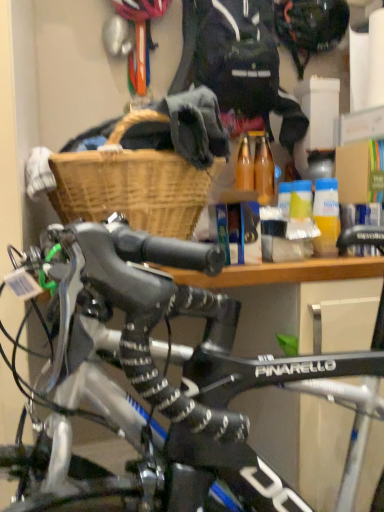
Question: Considering the relative positions of dark blue fabric jacket at upper center and yellow matte bottle at center in the image provided, is dark blue fabric jacket at upper center behind yellow matte bottle at center?

Choices:
 (A) no
 (B) yes

Answer: (B)

Question: Is dark blue fabric jacket at upper center in front of yellow matte bottle at center?

Choices:
 (A) no
 (B) yes

Answer: (A)

Question: Are dark blue fabric jacket at upper center and yellow matte bottle at center located far from each other?

Choices:
 (A) no
 (B) yes

Answer: (A)

Question: From a real-world perspective, is dark blue fabric jacket at upper center located beneath yellow matte bottle at center?

Choices:
 (A) no
 (B) yes

Answer: (A)

Question: From a real-world perspective, does dark blue fabric jacket at upper center stand above yellow matte bottle at center?

Choices:
 (A) no
 (B) yes

Answer: (B)

Question: Considering the relative sizes of dark blue fabric jacket at upper center and yellow matte bottle at center in the image provided, is dark blue fabric jacket at upper center shorter than yellow matte bottle at center?

Choices:
 (A) no
 (B) yes

Answer: (A)

Question: From a real-world perspective, is yellow matte bottle at center over black matte helmet at upper center?

Choices:
 (A) yes
 (B) no

Answer: (B)

Question: Is yellow matte bottle at center at the right side of black matte helmet at upper center?

Choices:
 (A) yes
 (B) no

Answer: (B)

Question: Considering the relative positions of yellow matte bottle at center and black matte helmet at upper center in the image provided, is yellow matte bottle at center in front of black matte helmet at upper center?

Choices:
 (A) yes
 (B) no

Answer: (A)

Question: Considering the relative sizes of yellow matte bottle at center and black matte helmet at upper center in the image provided, is yellow matte bottle at center wider than black matte helmet at upper center?

Choices:
 (A) no
 (B) yes

Answer: (A)

Question: Is yellow matte bottle at center looking in the opposite direction of black matte helmet at upper center?

Choices:
 (A) no
 (B) yes

Answer: (A)

Question: Does yellow matte bottle at center have a smaller size compared to black matte helmet at upper center?

Choices:
 (A) yes
 (B) no

Answer: (A)

Question: Could you tell me if black matte helmet at upper center is facing woven wood basket at upper center?

Choices:
 (A) yes
 (B) no

Answer: (B)